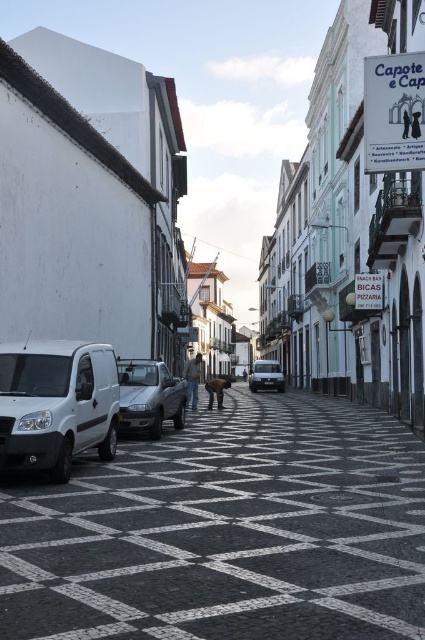
Is white matte van at lower left positioned before matte silver van at center?

That is True.

Does point (68, 403) come in front of point (255, 385)?

Yes, it is.

This screenshot has height=640, width=425. Find the location of `white matte van at lower left`. white matte van at lower left is located at coordinates (56, 404).

Does point (90, 362) come in front of point (178, 428)?

That is True.

Does point (40, 410) lie behind point (170, 385)?

No, (40, 410) is in front of (170, 385).

This screenshot has width=425, height=640. Identify the location of white matte van at lower left. (56, 404).

Is white glossy van at left positioned before matte silver van at center?

That is True.

Between white glossy van at left and matte silver van at center, which one appears on the right side from the viewer's perspective?

Positioned to the right is matte silver van at center.

Based on the photo, who is more forward, (x=337, y=634) or (x=278, y=368)?

Point (x=337, y=634) is more forward.

I want to click on white glossy van at left, so click(226, 531).